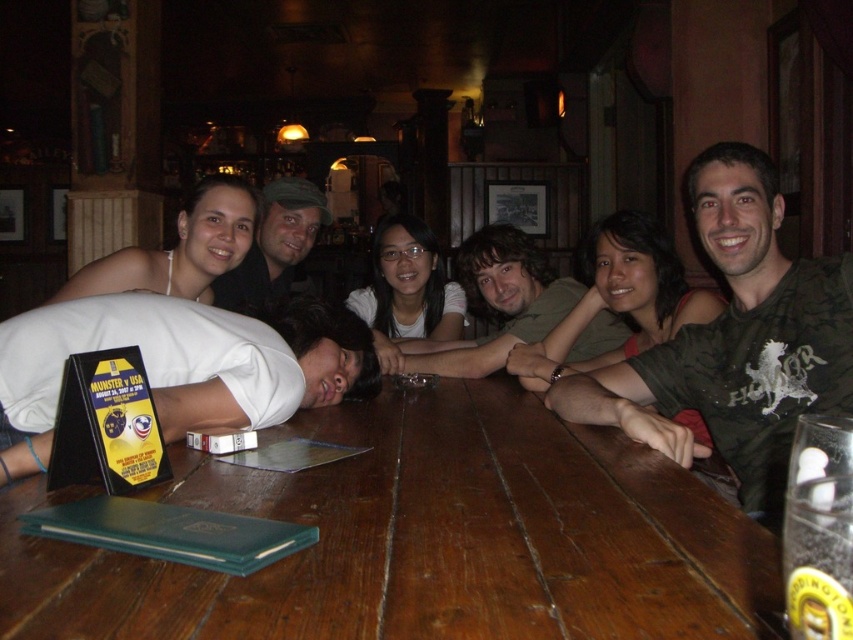
You are a photographer trying to capture a closeup of the dark brown hair at center and the matte black shirt at center. Which object should you zoom in on to ensure both are in focus without adjusting the camera distance?

The dark brown hair at center is smaller than the matte black shirt at center, so you should zoom in on the dark brown hair at center to ensure both are in focus without moving the camera.

You are a photographer trying to capture a candid shot of the two central figures at the table. Since you want to ensure their faces are clearly visible, you notice the dark brown hair at center and the matte black shirt at center. Which of these two items is wider, potentially blocking more light when positioned between the camera and their faces?

The dark brown hair at center might be wider than the matte black shirt at center, so it could block more light and obscure the faces more if placed between the camera and the subjects.